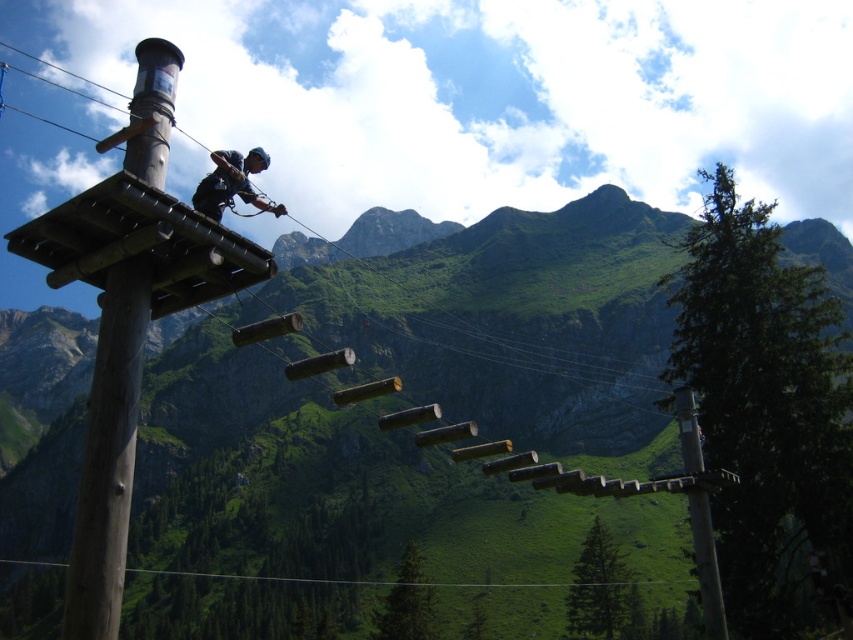
Does brown wooden pole at upper left have a lesser width compared to dark blue fabric harness at center?

Yes, brown wooden pole at upper left is thinner than dark blue fabric harness at center.

Can you confirm if brown wooden pole at upper left is positioned below dark blue fabric harness at center?

Indeed, brown wooden pole at upper left is positioned under dark blue fabric harness at center.

Is point (115, 323) closer to camera compared to point (215, 188)?

Yes, it is.

Where is `brown wooden pole at upper left`? The image size is (853, 640). brown wooden pole at upper left is located at coordinates (108, 458).